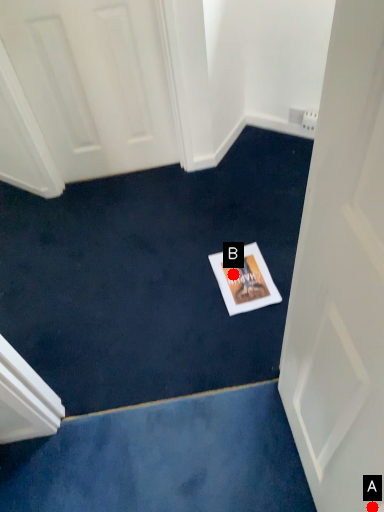
Question: Two points are circled on the image, labeled by A and B beside each circle. Which point appears farthest from the camera in this image?

Choices:
 (A) A is further
 (B) B is further

Answer: (B)